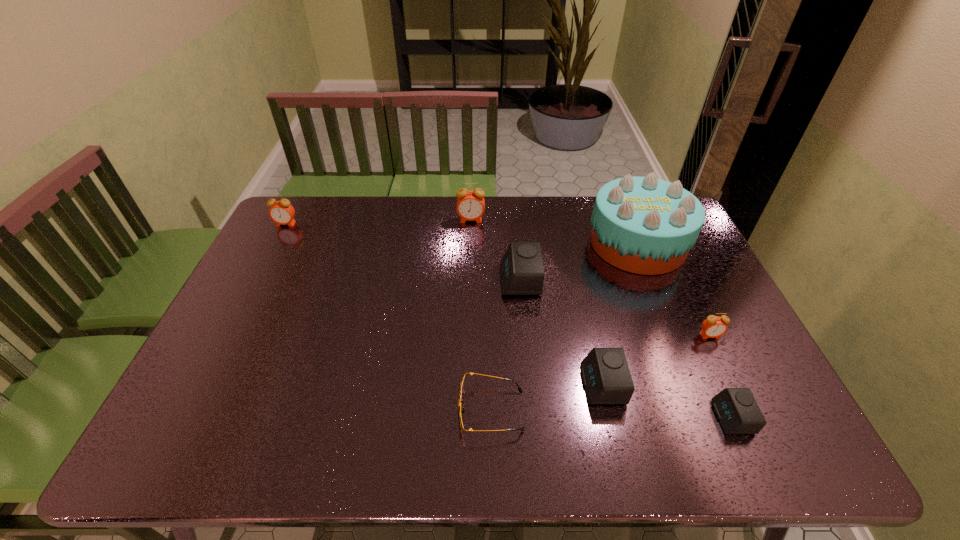
I want to click on cake, so click(644, 225).

Where is `the second tallest object`? This screenshot has width=960, height=540. the second tallest object is located at coordinates (470, 206).

Find the location of `the tallest alarm clock`. the tallest alarm clock is located at coordinates (470, 206).

Identify the location of the leftmost pink alarm clock. (281, 212).

Locate an element on the screen. This screenshot has width=960, height=540. the fifth shortest alarm clock is located at coordinates [x=281, y=212].

Identify the location of the fourth alarm clock from right to left. pyautogui.click(x=521, y=268).

Image resolution: width=960 pixels, height=540 pixels. Find the location of `the leftmost black alarm clock`. the leftmost black alarm clock is located at coordinates (521, 268).

Identify the location of the rightmost pink alarm clock. (714, 326).

Locate an element on the screen. This screenshot has height=540, width=960. the fifth farthest object is located at coordinates (714, 326).

Where is `the fourth object from right to left`? The width and height of the screenshot is (960, 540). the fourth object from right to left is located at coordinates (606, 377).